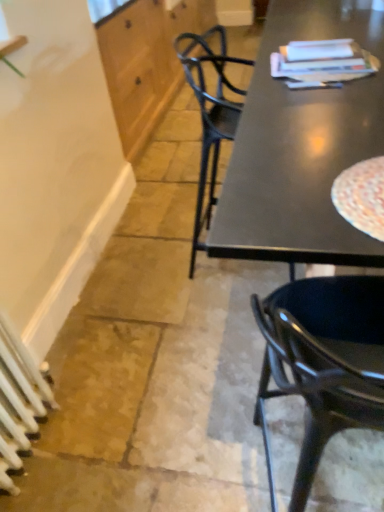
Locate an element on the screen. The image size is (384, 512). free point below white metallic radiator at lower left (from a real-world perspective) is located at coordinates [x=29, y=455].